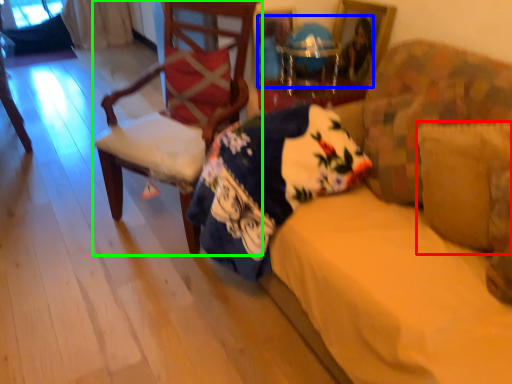
Question: Which is farther away from pillow (highlighted by a red box)? couple (highlighted by a blue box) or chair (highlighted by a green box)?

Choices:
 (A) couple
 (B) chair

Answer: (B)